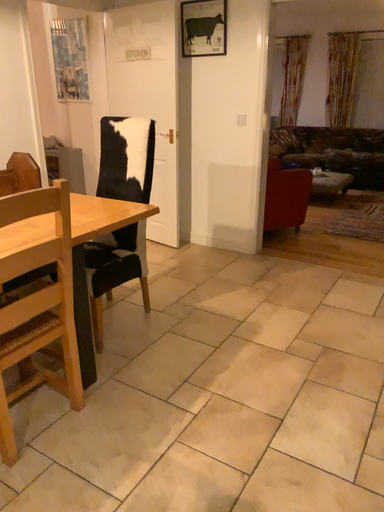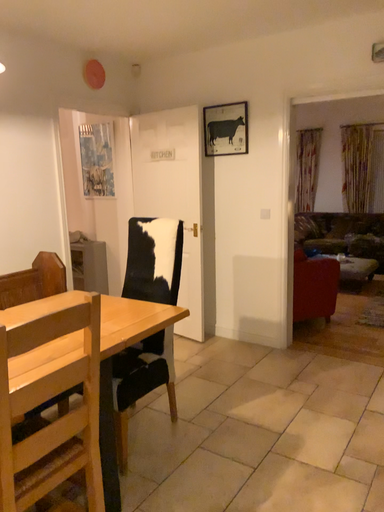
Question: Which way did the camera rotate in the video?

Choices:
 (A) rotated downward
 (B) rotated upward

Answer: (B)